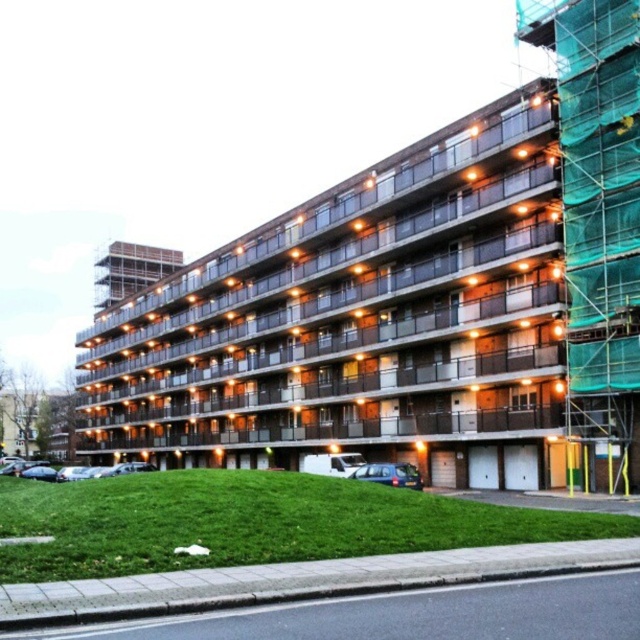
Which of these two, brown concrete building at center or green mesh scaffolding at right, stands shorter?

Standing shorter between the two is green mesh scaffolding at right.

What do you see at coordinates (362, 323) in the screenshot? The width and height of the screenshot is (640, 640). I see `brown concrete building at center` at bounding box center [362, 323].

Between point (321, 202) and point (589, 99), which one is positioned behind?

The point (321, 202) is behind.

The image size is (640, 640). What are the coordinates of `brown concrete building at center` in the screenshot? It's located at (362, 323).